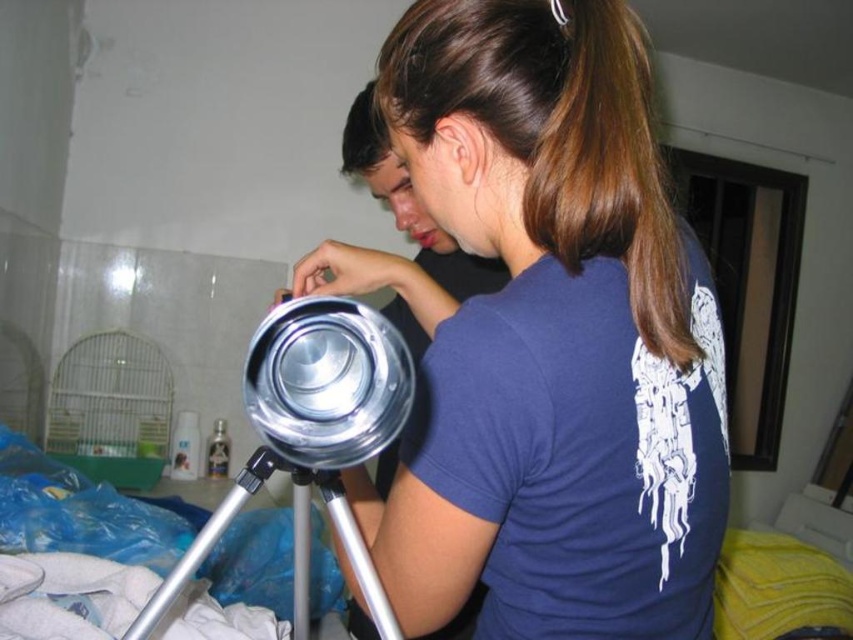
Question: Among these objects, which one is nearest to the camera?

Choices:
 (A) shiny metallic tripod at center
 (B) silver metallic tripod at center

Answer: (B)

Question: Which object is closer to the camera taking this photo?

Choices:
 (A) silver metallic tripod at center
 (B) shiny metallic tripod at center

Answer: (A)

Question: Does shiny metallic tripod at center have a greater width compared to silver metallic tripod at center?

Choices:
 (A) yes
 (B) no

Answer: (A)

Question: Does shiny metallic tripod at center appear on the right side of silver metallic tripod at center?

Choices:
 (A) yes
 (B) no

Answer: (A)

Question: Which point appears closest to the camera in this image?

Choices:
 (A) (178, 566)
 (B) (532, 193)

Answer: (A)

Question: Observing the image, what is the correct spatial positioning of shiny metallic tripod at center in reference to silver metallic tripod at center?

Choices:
 (A) left
 (B) right

Answer: (B)